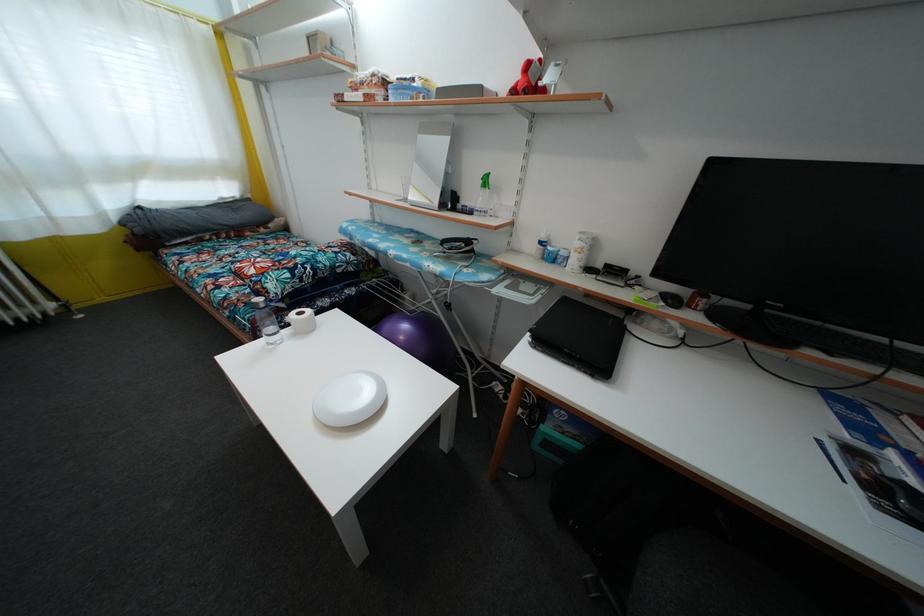
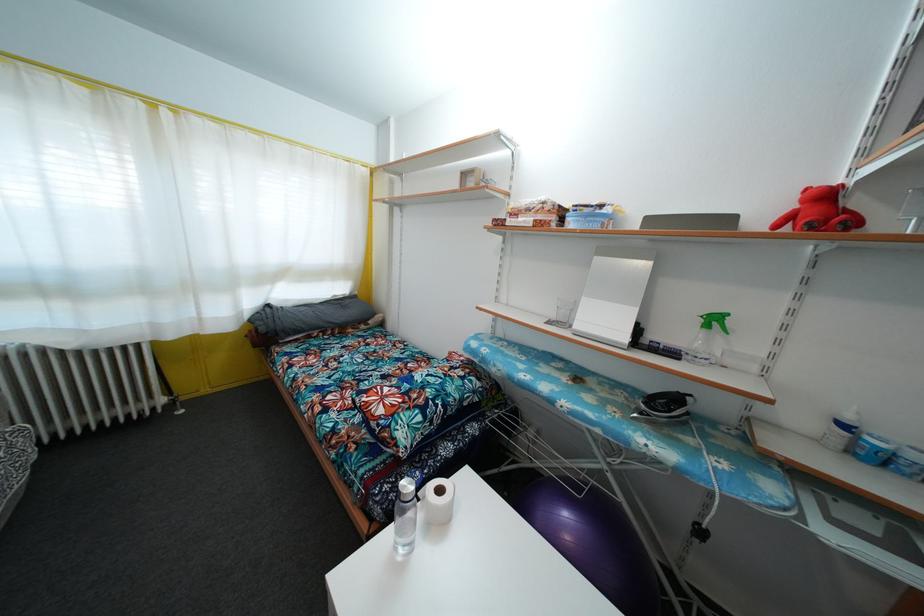
Find the pixel in the second image that matches (406,345) in the first image.

(572, 545)